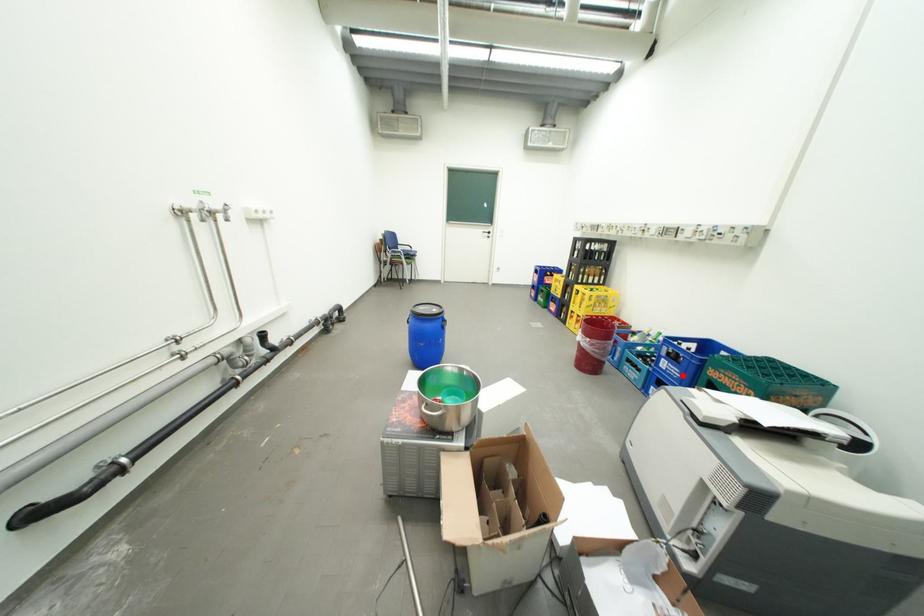
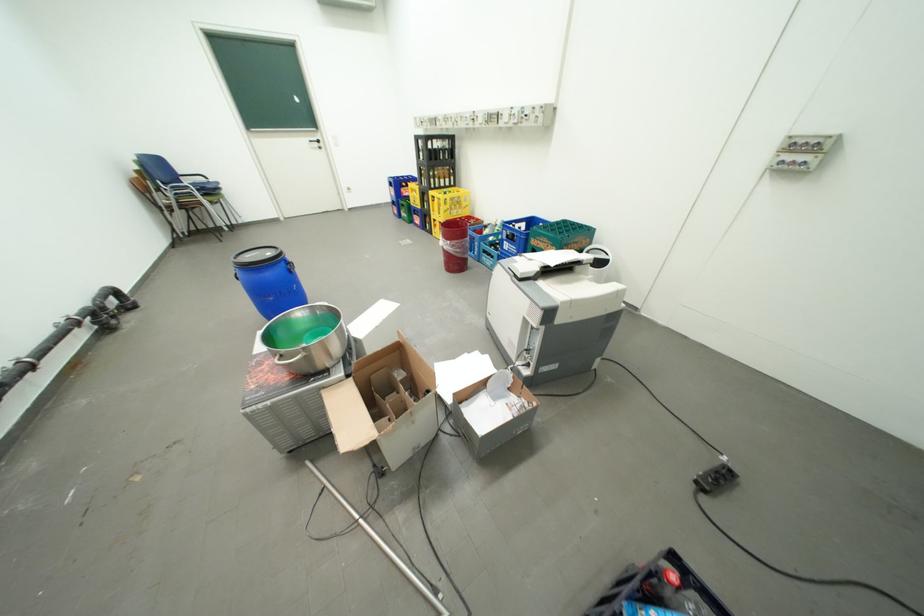
Question: I am providing you with two images of the same scene from different viewpoints. Image1 has a red point marked. In image2, the corresponding 3D location appears at what relative position? Reply with the corresponding letter.

Choices:
 (A) Closer
 (B) Farther

Answer: (B)